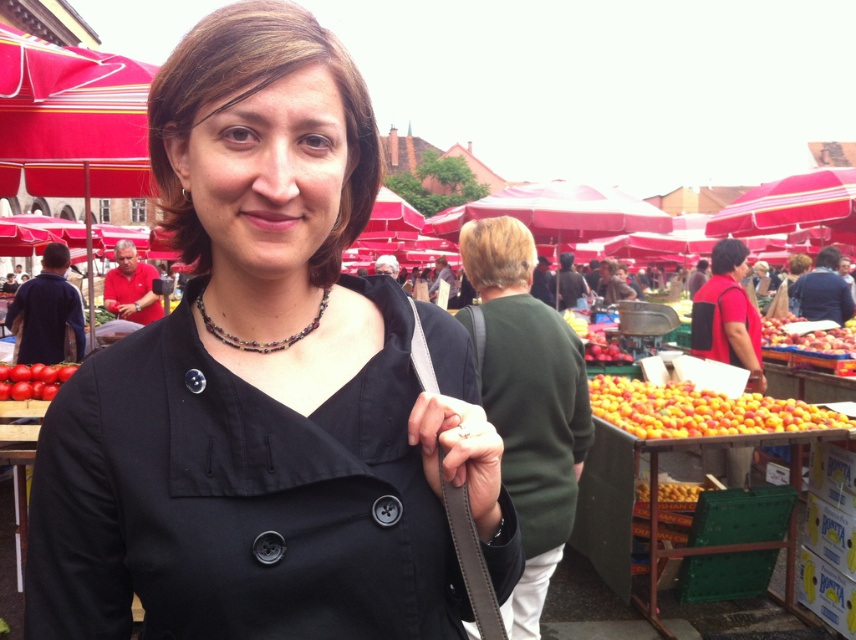
Which of these two, black matte coat at center or green matte sweater at center, stands taller?

green matte sweater at center

Is point (461, 460) positioned before point (545, 349)?

Yes, it is in front of point (545, 349).

What do you see at coordinates (265, 385) in the screenshot? Image resolution: width=856 pixels, height=640 pixels. I see `black matte coat at center` at bounding box center [265, 385].

I want to click on black matte coat at center, so coord(265,385).

Is black matte coat at center thinner than red fabric vendor at left?

Indeed, black matte coat at center has a lesser width compared to red fabric vendor at left.

Can you confirm if black matte coat at center is wider than red fabric vendor at left?

Incorrect, black matte coat at center's width does not surpass red fabric vendor at left's.

Is point (69, 627) positioned before point (116, 243)?

Yes, it is in front of point (116, 243).

The width and height of the screenshot is (856, 640). Identify the location of black matte coat at center. (265, 385).

Is yellow matte peaches at right above shiny red tomato at lower left?

No.

Is yellow matte peaches at right positioned in front of shiny red tomato at lower left?

No, yellow matte peaches at right is further to the viewer.

The image size is (856, 640). I want to click on yellow matte peaches at right, so 700,410.